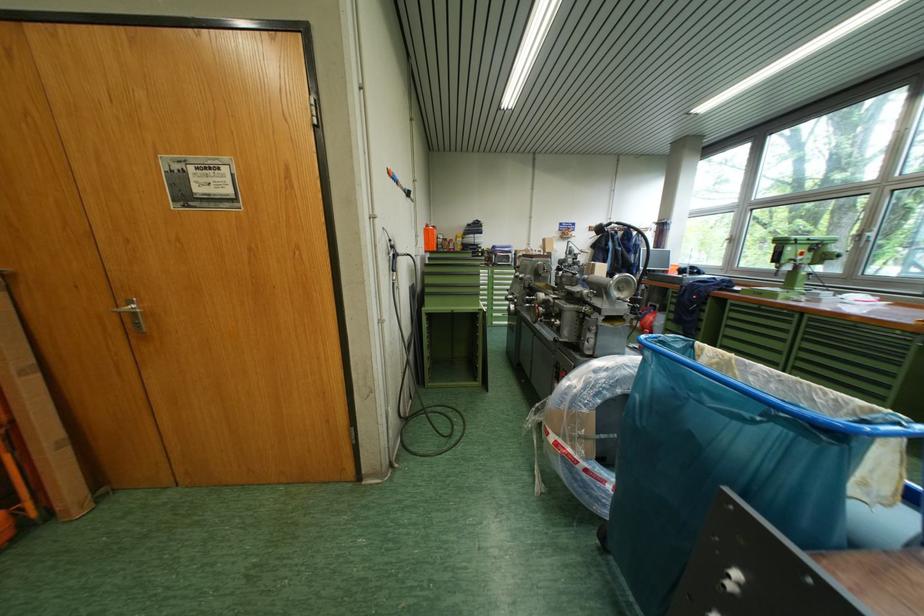
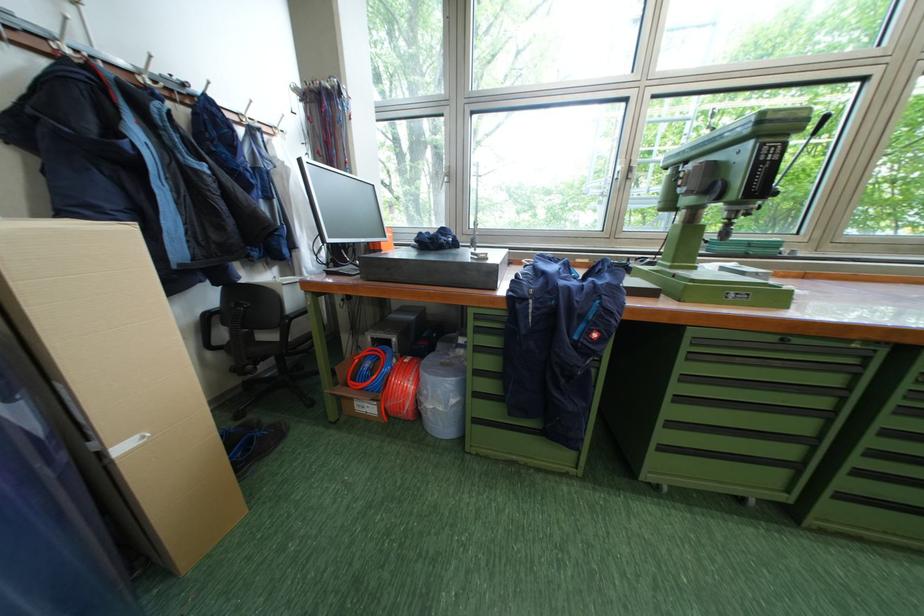
Find the pixel in the second image that matches pixel 662 325 in the first image.

(427, 405)